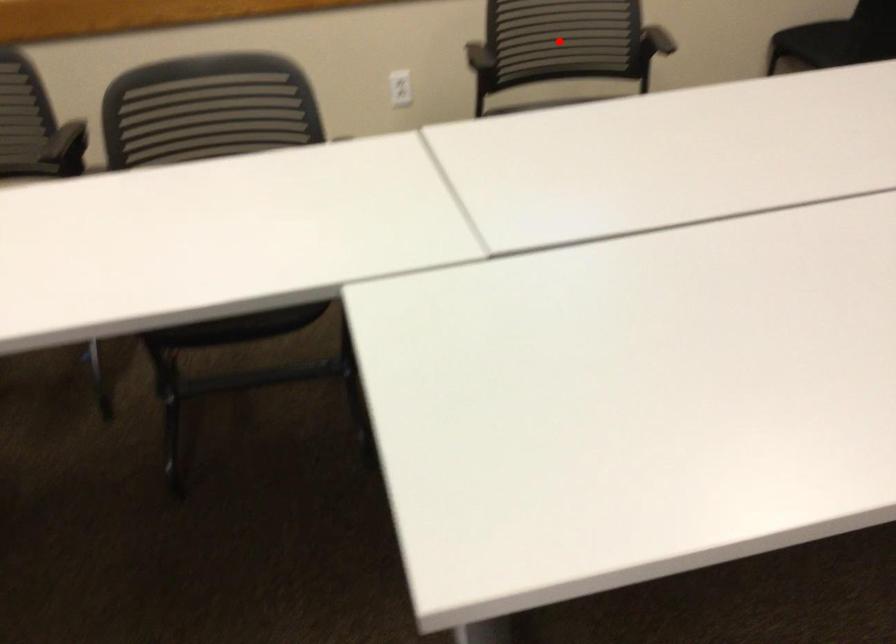
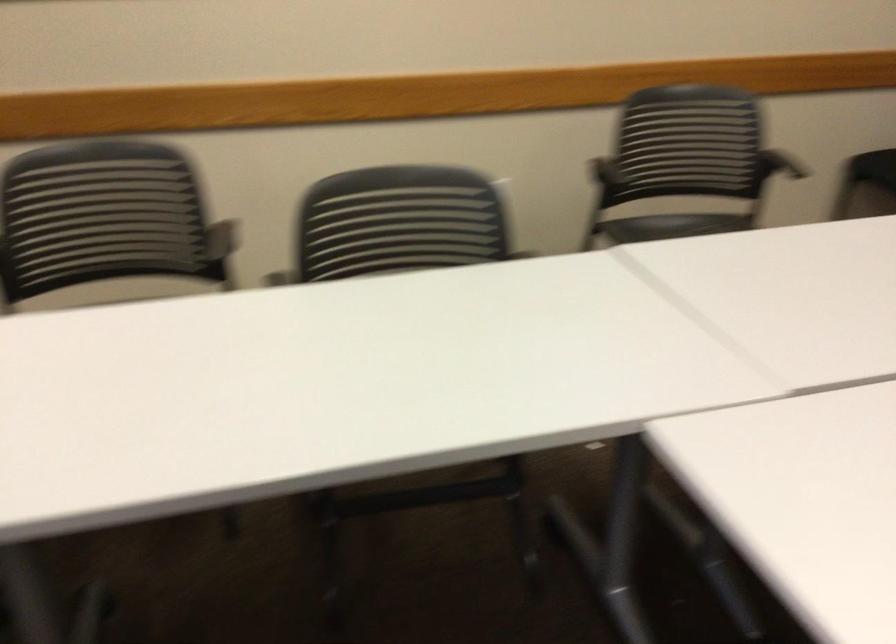
Question: I am providing you with two images of the same scene from different viewpoints. A red point is marked on the first image. At the location where the point appears in image 1, is it still visible in image 2?

Choices:
 (A) Yes
 (B) No

Answer: (B)